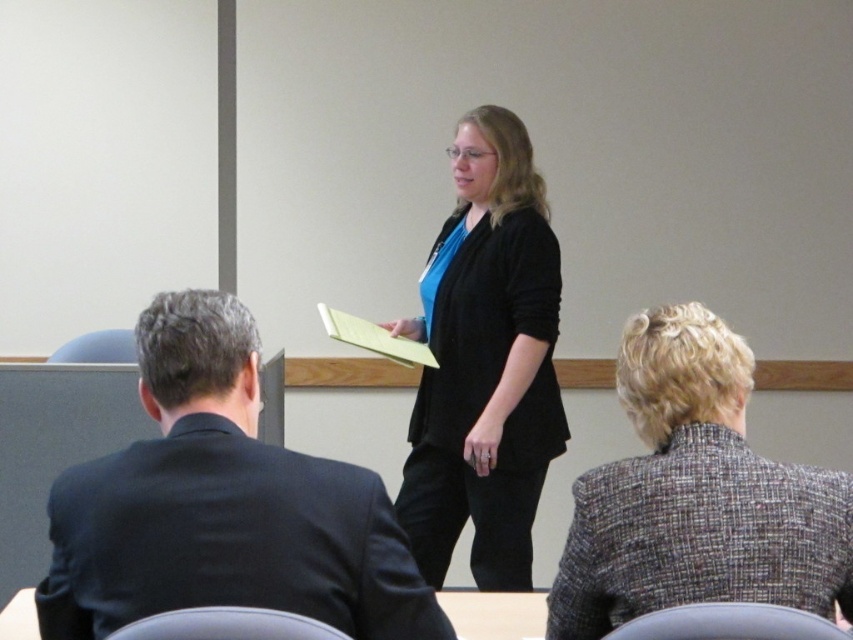
Can you confirm if gray tweed blazer at lower right is positioned to the right of matte black blazer at center?

Indeed, gray tweed blazer at lower right is positioned on the right side of matte black blazer at center.

Is gray tweed blazer at lower right further to the viewer compared to matte black blazer at center?

No, gray tweed blazer at lower right is in front of matte black blazer at center.

Does point (740, 408) come closer to viewer compared to point (424, 380)?

Yes, point (740, 408) is in front of point (424, 380).

Image resolution: width=853 pixels, height=640 pixels. Identify the location of gray tweed blazer at lower right. (695, 493).

From the picture: Can you confirm if dark blue suit at left is taller than matte black blazer at center?

Incorrect, dark blue suit at left's height is not larger of matte black blazer at center's.

Does dark blue suit at left have a lesser width compared to matte black blazer at center?

Incorrect, dark blue suit at left's width is not less than matte black blazer at center's.

This screenshot has width=853, height=640. Identify the location of dark blue suit at left. (222, 504).

Between dark blue suit at left and gray tweed blazer at lower right, which one is positioned lower?

Positioned lower is dark blue suit at left.

Does dark blue suit at left have a lesser height compared to gray tweed blazer at lower right?

Correct, dark blue suit at left is not as tall as gray tweed blazer at lower right.

At what (x,y) coordinates should I click in order to perform the action: click on dark blue suit at left. Please return your answer as a coordinate pair (x, y). This screenshot has height=640, width=853. Looking at the image, I should click on (222, 504).

Where is `dark blue suit at left`? dark blue suit at left is located at coordinates (222, 504).